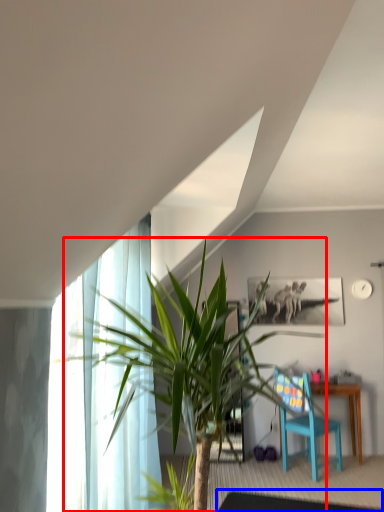
Question: Which of the following is the farthest to the observer, houseplant (highlighted by a red box) or glass table (highlighted by a blue box)?

Choices:
 (A) houseplant
 (B) glass table

Answer: (B)